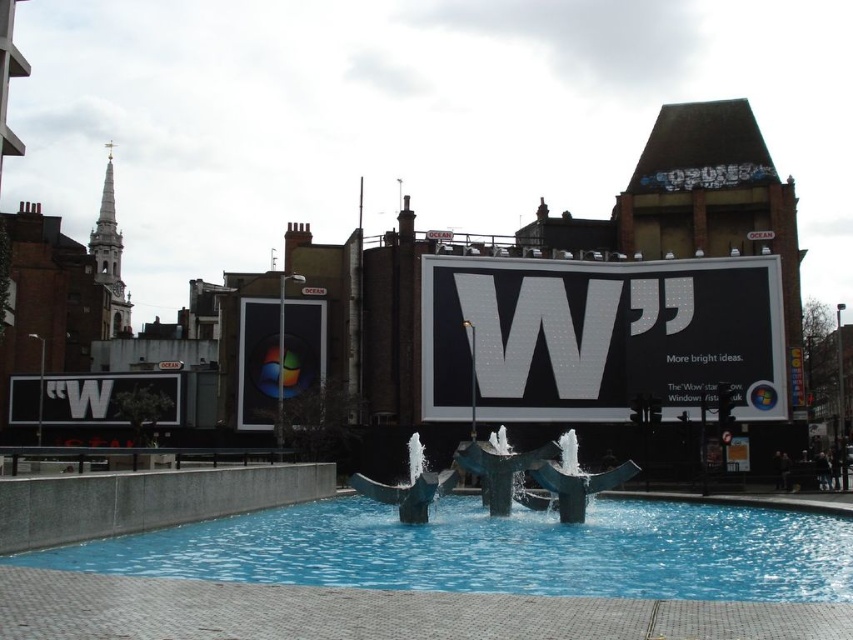
Question: Does blue glossy water at center appear over matte glass window at center?

Choices:
 (A) yes
 (B) no

Answer: (B)

Question: Which object is farther from the camera taking this photo?

Choices:
 (A) blue glossy water at center
 (B) white matte sign at lower left
 (C) matte glass window at center

Answer: (B)

Question: Can you confirm if blue glossy water at center is wider than matte black sign at center?

Choices:
 (A) yes
 (B) no

Answer: (A)

Question: Can you confirm if matte black sign at center is thinner than white matte sign at lower left?

Choices:
 (A) no
 (B) yes

Answer: (A)

Question: Which of the following is the farthest from the observer?

Choices:
 (A) (138, 380)
 (B) (491, 525)
 (C) (244, 390)
 (D) (682, 333)

Answer: (A)

Question: Which of the following is the closest to the observer?

Choices:
 (A) blue glossy water at center
 (B) matte black sign at center

Answer: (A)